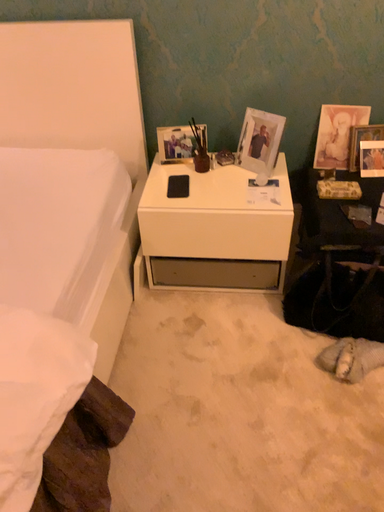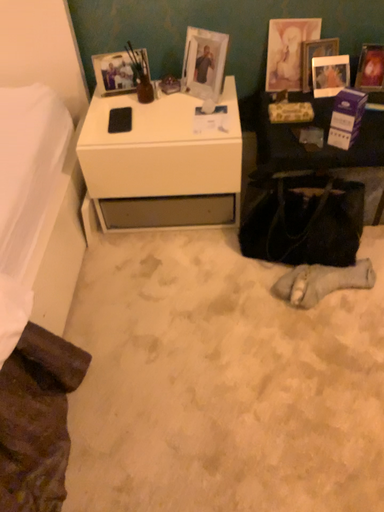
Question: How did the camera likely rotate when shooting the video?

Choices:
 (A) rotated downward
 (B) rotated upward

Answer: (A)